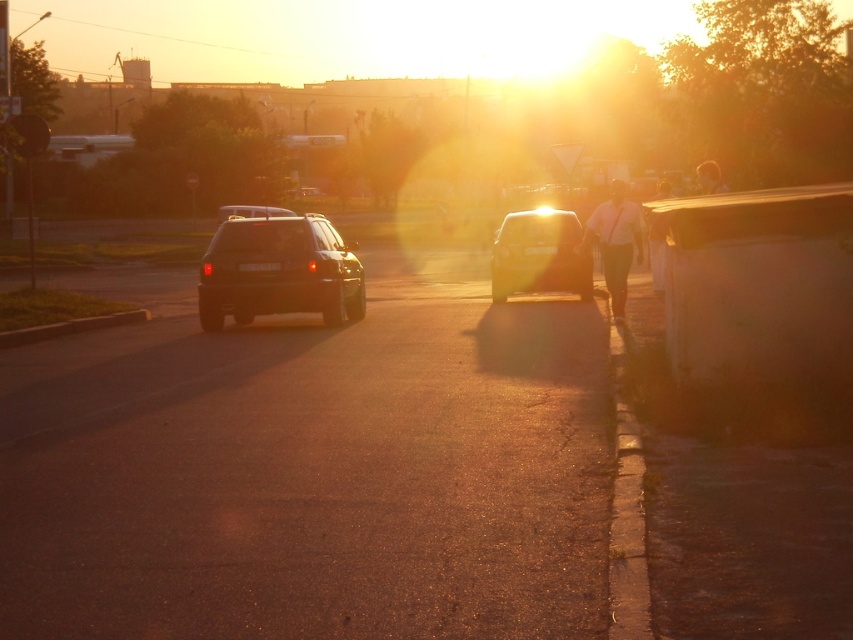
Does satin black suv at center have a greater height compared to satin black car at center?

In fact, satin black suv at center may be shorter than satin black car at center.

Measure the distance between satin black suv at center and satin black car at center.

26.07 meters

Where is `satin black suv at center`? The width and height of the screenshot is (853, 640). satin black suv at center is located at coordinates (277, 272).

Which is behind, point (281, 264) or point (604, 227)?

The point (281, 264) is behind.

Is satin black suv at center bigger than white fabric shirt at center-right?

Actually, satin black suv at center might be smaller than white fabric shirt at center-right.

Between point (259, 241) and point (624, 304), which one is positioned in front?

Positioned in front is point (624, 304).

Find the location of a particular element. satin black suv at center is located at coordinates (277, 272).

Between point (660, 193) and point (225, 218), which one is positioned in front?

Point (660, 193) is in front.

Does point (663, 220) come in front of point (259, 211)?

Yes, point (663, 220) is in front of point (259, 211).

Image resolution: width=853 pixels, height=640 pixels. I want to click on smooth white shirt at center, so coord(656,234).